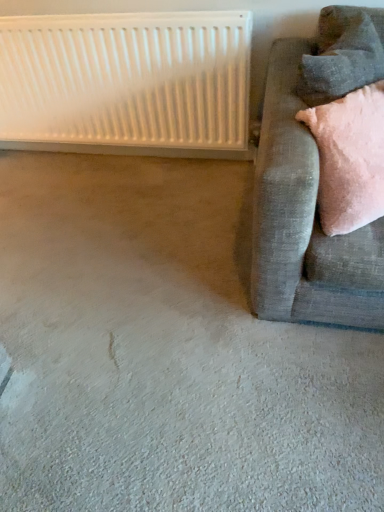
Question: Does velvet gray pillow at upper right have a greater height compared to white plastic radiator at upper left?

Choices:
 (A) no
 (B) yes

Answer: (A)

Question: Is velvet gray pillow at upper right completely or partially outside of white plastic radiator at upper left?

Choices:
 (A) no
 (B) yes

Answer: (B)

Question: From a real-world perspective, is velvet gray pillow at upper right under white plastic radiator at upper left?

Choices:
 (A) yes
 (B) no

Answer: (B)

Question: Can white plastic radiator at upper left be found inside velvet gray pillow at upper right?

Choices:
 (A) no
 (B) yes

Answer: (A)

Question: Does velvet gray pillow at upper right have a greater width compared to white plastic radiator at upper left?

Choices:
 (A) yes
 (B) no

Answer: (A)

Question: Is velvet gray pillow at upper right bigger than white plastic radiator at upper left?

Choices:
 (A) yes
 (B) no

Answer: (B)

Question: Can you confirm if velvet grey couch at right is positioned to the left of white plastic radiator at upper left?

Choices:
 (A) no
 (B) yes

Answer: (A)

Question: Is white plastic radiator at upper left inside velvet grey couch at right?

Choices:
 (A) no
 (B) yes

Answer: (A)

Question: Is there a large distance between velvet grey couch at right and white plastic radiator at upper left?

Choices:
 (A) yes
 (B) no

Answer: (B)

Question: Is velvet grey couch at right thinner than white plastic radiator at upper left?

Choices:
 (A) yes
 (B) no

Answer: (B)

Question: Are velvet grey couch at right and white plastic radiator at upper left beside each other?

Choices:
 (A) no
 (B) yes

Answer: (A)

Question: Is velvet grey couch at right smaller than white plastic radiator at upper left?

Choices:
 (A) yes
 (B) no

Answer: (B)

Question: Considering the relative sizes of velvet gray pillow at upper right and velvet grey couch at right in the image provided, is velvet gray pillow at upper right wider than velvet grey couch at right?

Choices:
 (A) yes
 (B) no

Answer: (B)